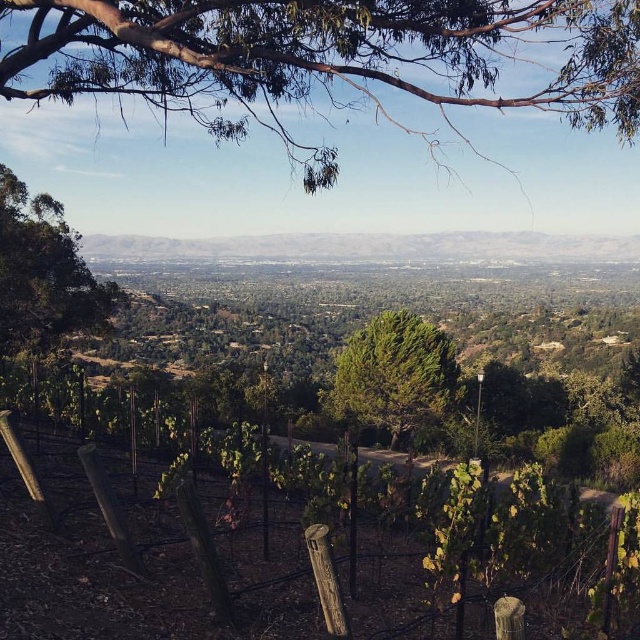
Between green leafy branches at upper center and green leafy tree at left, which one has more height?

With more height is green leafy branches at upper center.

Is point (156, 106) behind point (1, 241)?

Yes, point (156, 106) is behind point (1, 241).

Find the location of a particular element. This screenshot has width=640, height=640. green leafy branches at upper center is located at coordinates (317, 58).

Who is positioned more to the left, green leafy branches at upper center or green textured tree at center?

Positioned to the left is green leafy branches at upper center.

Measure the distance between green leafy branches at upper center and camera.

green leafy branches at upper center and camera are 7.35 meters apart from each other.

At what (x,y) coordinates should I click in order to perform the action: click on green leafy branches at upper center. Please return your answer as a coordinate pair (x, y). Looking at the image, I should click on (317, 58).

Is green leafy tree at left thinner than green textured tree at center?

Correct, green leafy tree at left's width is less than green textured tree at center's.

Between green leafy tree at left and green textured tree at center, which one is positioned lower?

green textured tree at center

Who is more forward, (x=38, y=204) or (x=397, y=374)?

Point (x=38, y=204)

Where is `green leafy tree at left`? green leafy tree at left is located at coordinates (44, 275).